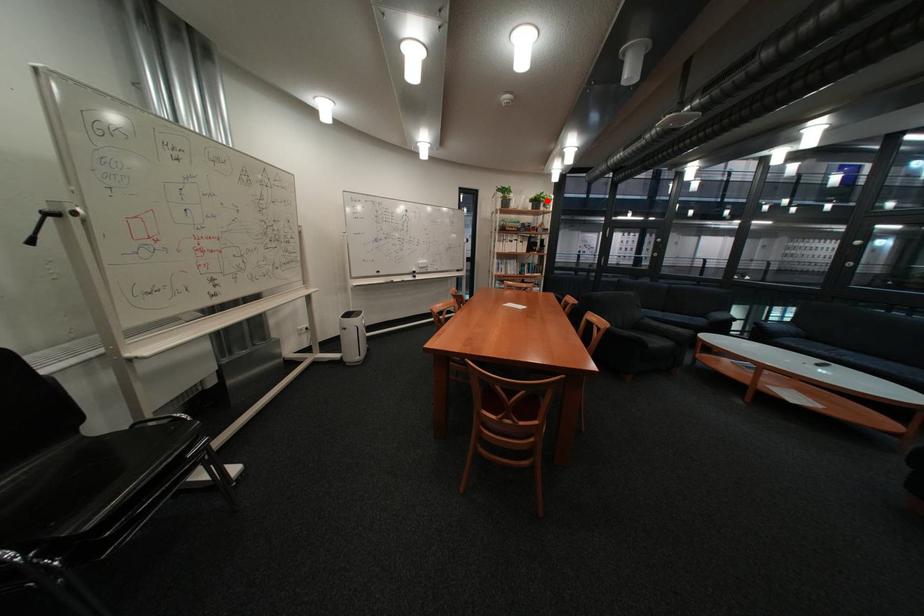
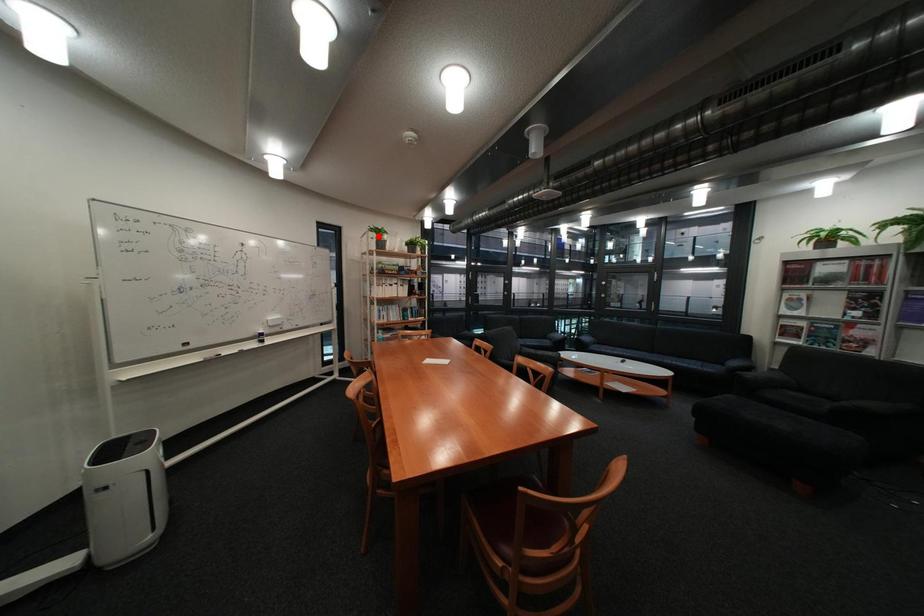
I am providing you with two images of the same scene from different viewpoints. A red point is marked on the first image and another point is marked on the second image. Does the point marked in image1 correspond to the same location as the one in image2?

No